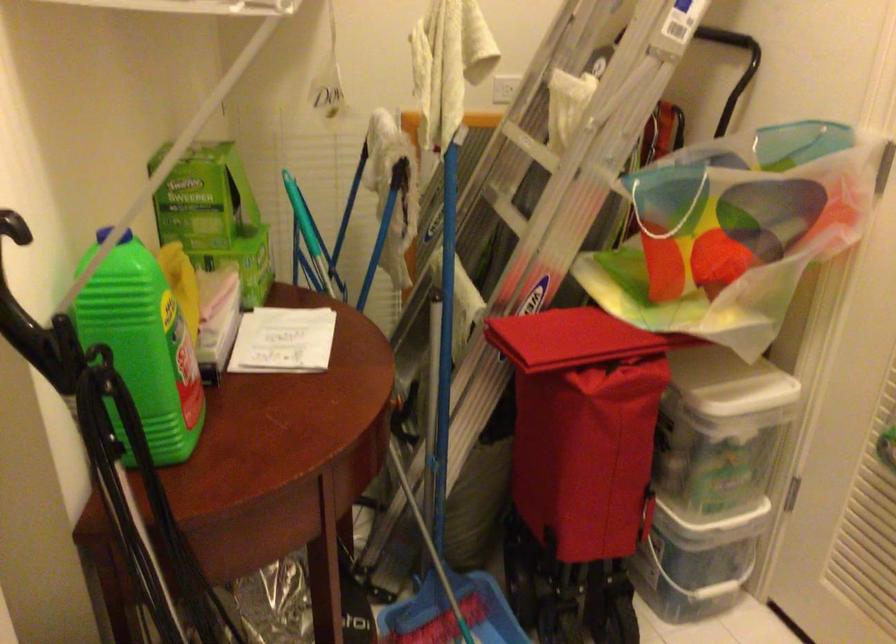
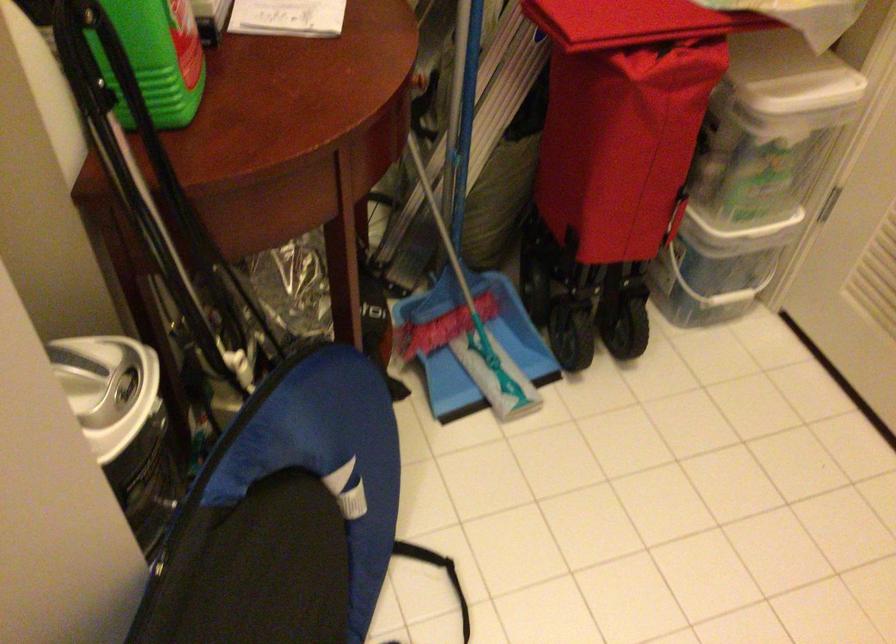
The point at (712, 471) is marked in the first image. Where is the corresponding point in the second image?

(752, 174)